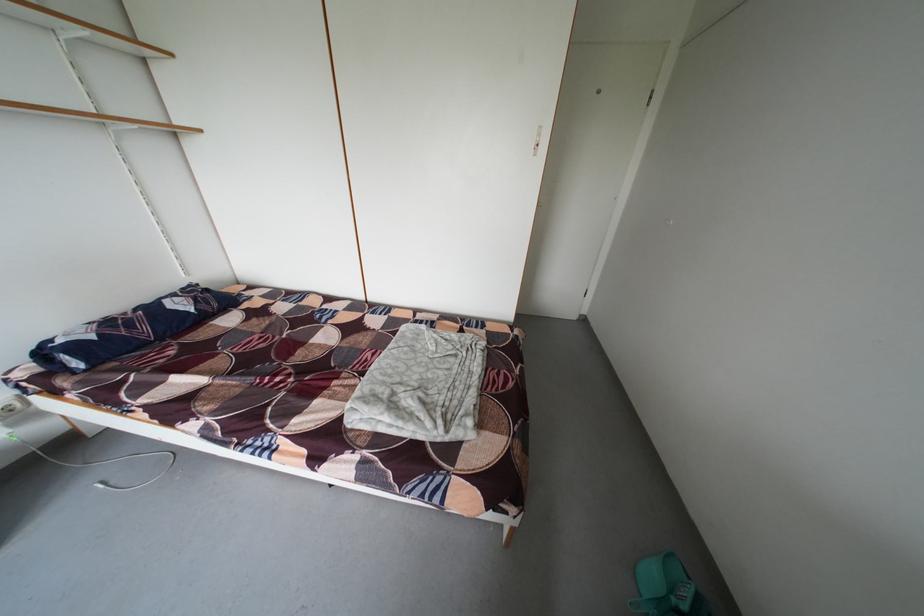
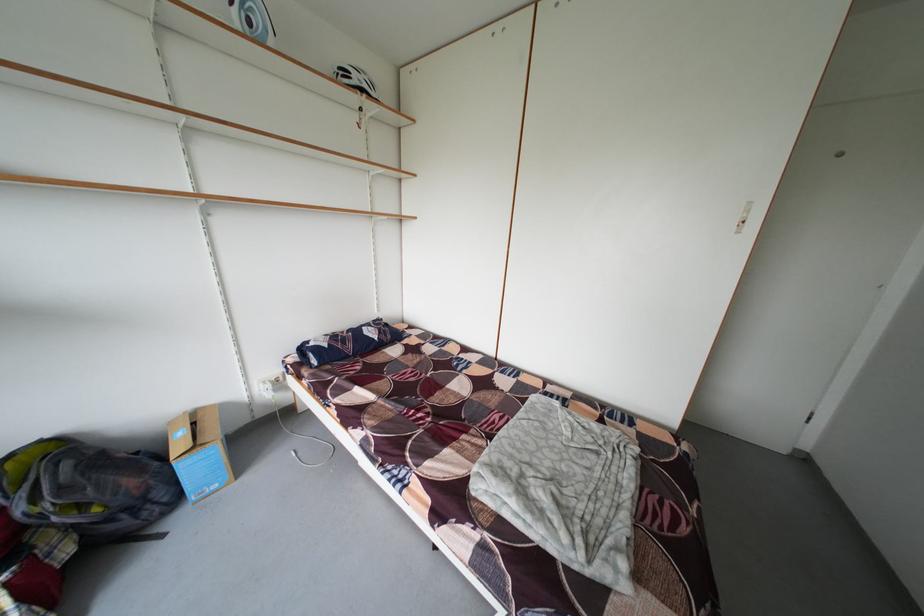
The point at [156,334] is marked in the first image. Where is the corresponding point in the second image?

(360, 351)